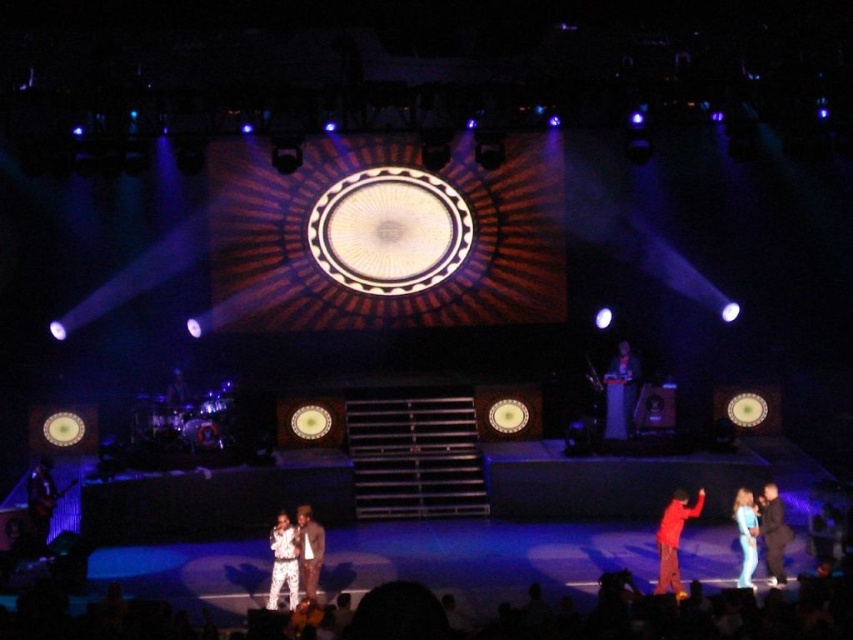
Based on the photo, can you confirm if white sequined outfit at center is taller than dark blue suit at lower right?

No.

Can you confirm if white sequined outfit at center is shorter than dark blue suit at lower right?

Yes, white sequined outfit at center is shorter than dark blue suit at lower right.

At what (x,y) coordinates should I click in order to perform the action: click on white sequined outfit at center. Please return your answer as a coordinate pair (x, y). Image resolution: width=853 pixels, height=640 pixels. Looking at the image, I should click on (283, 561).

Between point (677, 524) and point (279, 541), which one is positioned in front?

Point (279, 541)

Looking at this image, can you confirm if matte red pants at lower right is positioned below white sequined outfit at center?

Yes.

Is point (668, 582) in front of point (270, 588)?

No, it is not.

Locate an element on the screen. Image resolution: width=853 pixels, height=640 pixels. matte red pants at lower right is located at coordinates (672, 540).

Which of these two, matte red pants at lower right or shiny brown suit at center, stands shorter?

matte red pants at lower right

Is matte red pants at lower right below shiny brown suit at center?

Indeed, matte red pants at lower right is positioned under shiny brown suit at center.

I want to click on matte red pants at lower right, so click(672, 540).